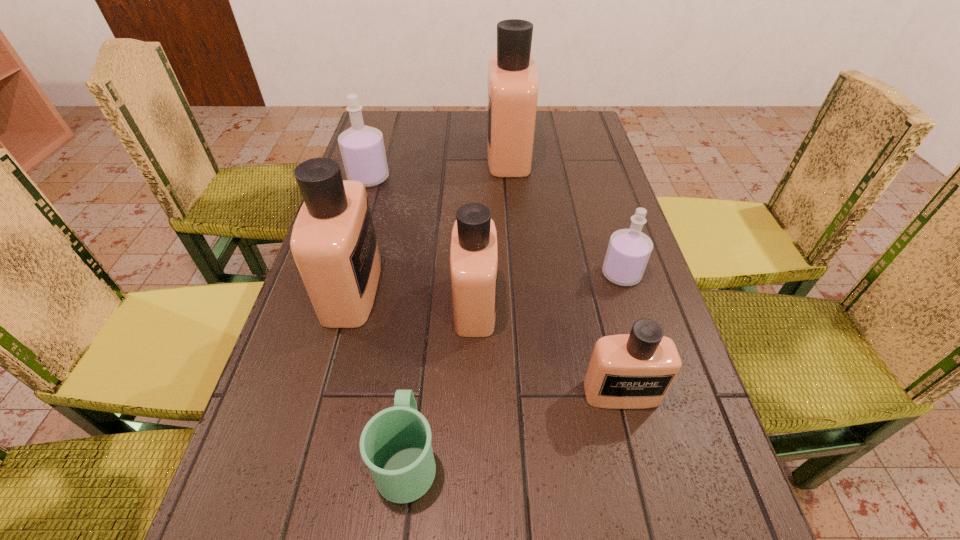
Locate an element on the screen. This screenshot has width=960, height=540. vacant area that lies between the right purple perfume and the left purple perfume is located at coordinates (495, 226).

Where is `vacant area that lies between the third object from left to right and the third smallest beige perfume`? Image resolution: width=960 pixels, height=540 pixels. vacant area that lies between the third object from left to right and the third smallest beige perfume is located at coordinates (380, 373).

Locate an element on the screen. The height and width of the screenshot is (540, 960). vacant area that lies between the sixth shortest object and the fifth object from right to left is located at coordinates (380, 373).

You are a GUI agent. You are given a task and a screenshot of the screen. Output one action in this format:
    pyautogui.click(x=<x>, y=<y>)
    Task: Click on the vacant area that lies between the third biggest beige perfume and the smallest beige perfume
    
    Given the screenshot: What is the action you would take?
    pyautogui.click(x=548, y=348)

Locate an element on the screen. This screenshot has height=540, width=960. free space between the smaller purple perfume and the left purple perfume is located at coordinates [495, 226].

Select which object appears as the second closest to the second smallest beige perfume. Please provide its 2D coordinates. Your answer should be formatted as a tuple, i.e. [(x, y)], where the tuple contains the x and y coordinates of a point satisfying the conditions above.

[(333, 242)]

Where is `object that can be found as the third closest to the leftmost beige perfume`? Image resolution: width=960 pixels, height=540 pixels. object that can be found as the third closest to the leftmost beige perfume is located at coordinates coord(362,148).

Find the location of a particular element. perfume that is the third closest one to the mug is located at coordinates (626, 371).

You are a GUI agent. You are given a task and a screenshot of the screen. Output one action in this format:
    pyautogui.click(x=<x>, y=<y>)
    Task: Click on the closest perfume to the fifth shortest perfume
    
    Given the screenshot: What is the action you would take?
    pyautogui.click(x=474, y=251)

Where is `the second closest beige perfume relative to the third biggest beige perfume`? This screenshot has height=540, width=960. the second closest beige perfume relative to the third biggest beige perfume is located at coordinates (626, 371).